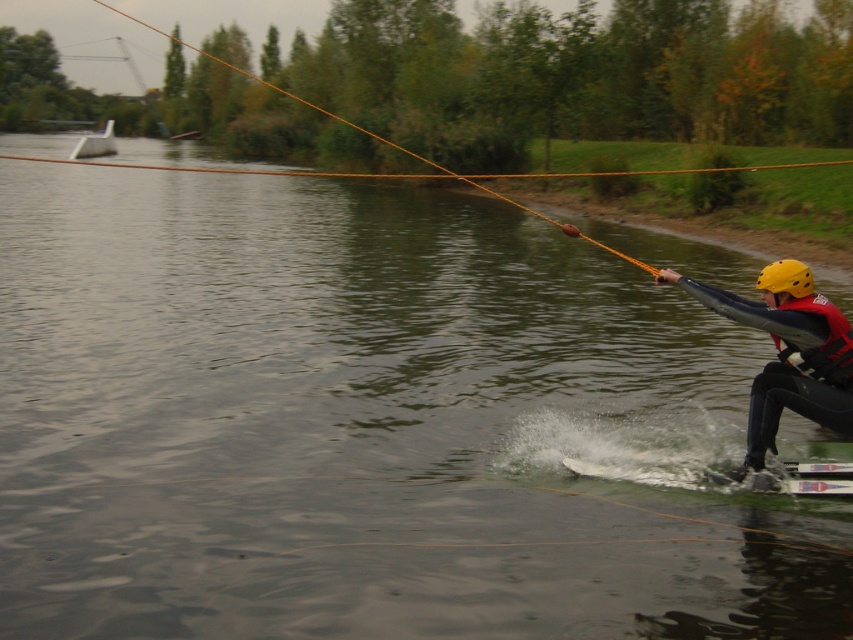
You are a photographer trying to capture the skier from the shore. You notice the black matte wetsuit at lower right and the red matte life jacket at right. Which object should you focus on first if you want to capture the skier in the center of your photo?

The black matte wetsuit at lower right is positioned on the left side of the red matte life jacket at right. To center the skier in your photo, focus on the red matte life jacket at right first since it is closer to the center than the black matte wetsuit at lower right.

You are a photographer trying to capture the water skier. You notice the red matte life jacket at right and the white plastic boat at upper left in your viewfinder. Which object should you focus on first to ensure it stays in the frame as you pan the camera?

The red matte life jacket at right is in front of the white plastic boat at upper left, so you should focus on the red matte life jacket at right first to keep it in the frame while panning.

You are standing at the camera position and want to throw a lifebuoy to the person wearing the red matte life jacket at right. The lifebuoy has a throwing range of 6 meters. Can you reach them?

The red matte life jacket at right is 5.90 meters away from camera, so yes, the lifebuoy can reach them since the distance is within the 6 meters range.